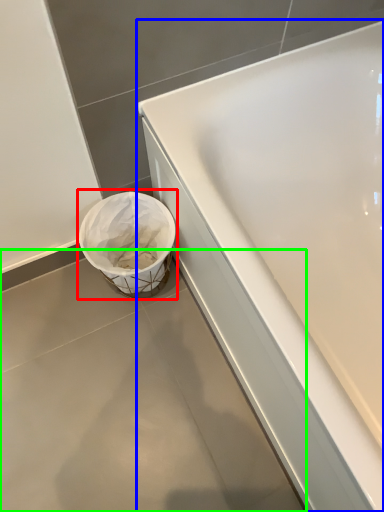
Question: Which object is positioned farthest from waste container (highlighted by a red box)? Select from bathtub (highlighted by a blue box) and concrete (highlighted by a green box).

Choices:
 (A) bathtub
 (B) concrete

Answer: (A)